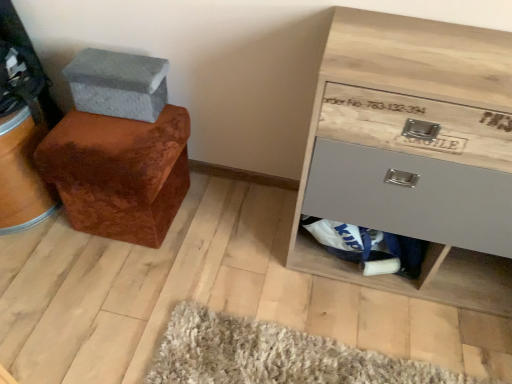
Question: From the image's perspective, is wooden chest of drawers at lower right located beneath matte gray drawer at lower right?

Choices:
 (A) yes
 (B) no

Answer: (B)

Question: Would you say matte gray drawer at lower right is part of wooden chest of drawers at lower right's contents?

Choices:
 (A) yes
 (B) no

Answer: (A)

Question: Is wooden chest of drawers at lower right at the right side of matte gray drawer at lower right?

Choices:
 (A) yes
 (B) no

Answer: (A)

Question: From the image's perspective, is wooden chest of drawers at lower right over matte gray drawer at lower right?

Choices:
 (A) no
 (B) yes

Answer: (B)

Question: Considering the relative positions of wooden chest of drawers at lower right and matte gray drawer at lower right in the image provided, is wooden chest of drawers at lower right to the left of matte gray drawer at lower right from the viewer's perspective?

Choices:
 (A) yes
 (B) no

Answer: (B)

Question: Considering the positions of point (79, 177) and point (352, 233), is point (79, 177) closer or farther from the camera than point (352, 233)?

Choices:
 (A) farther
 (B) closer

Answer: (B)

Question: From a real-world perspective, is velvet brown ottoman at left above or below matte gray drawer at lower right?

Choices:
 (A) above
 (B) below

Answer: (A)

Question: In terms of width, does velvet brown ottoman at left look wider or thinner when compared to matte gray drawer at lower right?

Choices:
 (A) thin
 (B) wide

Answer: (B)

Question: Visually, is velvet brown ottoman at left positioned to the left or to the right of matte gray drawer at lower right?

Choices:
 (A) left
 (B) right

Answer: (A)

Question: Looking at the image, does velvet brown ottoman at left seem bigger or smaller compared to gray fabric shoe box at upper left?

Choices:
 (A) big
 (B) small

Answer: (A)

Question: From a real-world perspective, relative to gray fabric shoe box at upper left, is velvet brown ottoman at left vertically above or below?

Choices:
 (A) below
 (B) above

Answer: (A)

Question: Is velvet brown ottoman at left wider or thinner than gray fabric shoe box at upper left?

Choices:
 (A) wide
 (B) thin

Answer: (A)

Question: Considering the positions of point (155, 162) and point (78, 109), is point (155, 162) closer or farther from the camera than point (78, 109)?

Choices:
 (A) closer
 (B) farther

Answer: (A)

Question: In the image, is gray fabric shoe box at upper left on the left side or the right side of matte gray drawer at lower right?

Choices:
 (A) left
 (B) right

Answer: (A)

Question: From a real-world perspective, is gray fabric shoe box at upper left above or below matte gray drawer at lower right?

Choices:
 (A) above
 (B) below

Answer: (A)